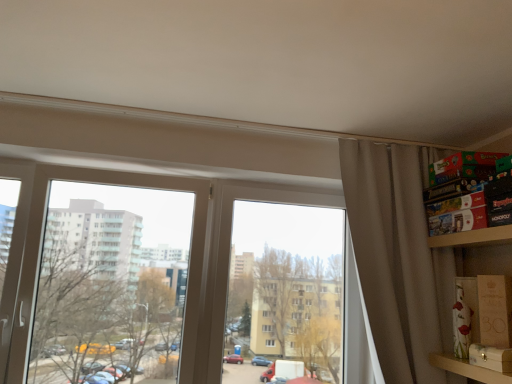
Question: Considering the positions of point (507, 372) and point (475, 329), is point (507, 372) closer or farther from the camera than point (475, 329)?

Choices:
 (A) farther
 (B) closer

Answer: (B)

Question: Based on their sizes in the image, would you say wooden box at right, which is the second cardboard box from back to front, is bigger or smaller than matte brown cardboard box at lower right, which is the 2th cardboard box from front to back?

Choices:
 (A) small
 (B) big

Answer: (A)

Question: Considering the real-world distances, which object is closest to the wooden at right?

Choices:
 (A) matte brown cardboard box at lower right, which is the 2th cardboard box from front to back
 (B) wooden box at right, which is the second cardboard box from back to front
 (C) beige fabric curtain at right
 (D) transparent glass window at left
 (E) transparent glass window at center

Answer: (B)

Question: Estimate the real-world distances between objects in this image. Which object is closer to the matte brown cardboard box at lower right, which is the 2th cardboard box from front to back?

Choices:
 (A) wooden at right
 (B) wooden box at right, the 1th cardboard box when ordered from front to back
 (C) transparent glass window at left
 (D) beige fabric curtain at right
 (E) transparent glass window at center

Answer: (B)